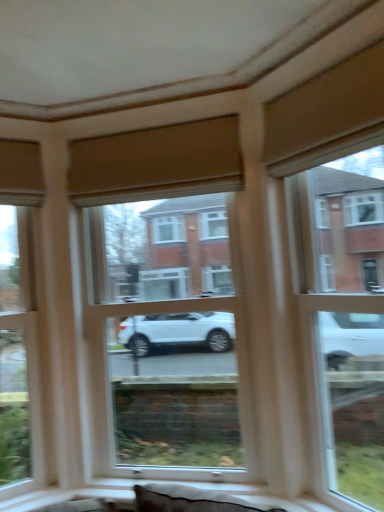
What do you see at coordinates (166, 337) in the screenshot?
I see `matte wood bay window at center` at bounding box center [166, 337].

Measure the distance between point (138, 234) and camera.

Point (138, 234) is 9.27 feet away from camera.

What is the approximate height of matte wood bay window at center?

1.86 meters.

The width and height of the screenshot is (384, 512). I want to click on matte wood bay window at center, so click(166, 337).

Identify the location of matte wood bay window at center. (166, 337).